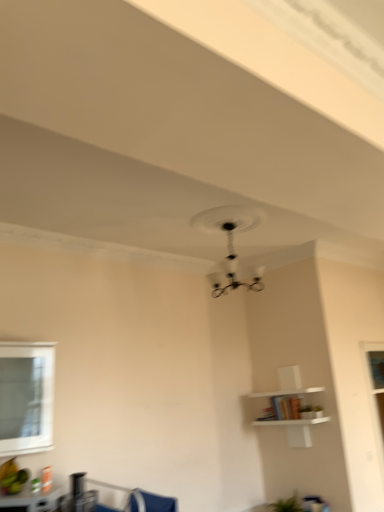
Question: Does matte black table at lower left have a greater width compared to blue fabric swivel chair at lower center?

Choices:
 (A) no
 (B) yes

Answer: (B)

Question: From a real-world perspective, is matte black table at lower left positioned over blue fabric swivel chair at lower center based on gravity?

Choices:
 (A) no
 (B) yes

Answer: (B)

Question: Could you tell me if matte black table at lower left is facing blue fabric swivel chair at lower center?

Choices:
 (A) no
 (B) yes

Answer: (A)

Question: Is matte black table at lower left at the right side of blue fabric swivel chair at lower center?

Choices:
 (A) yes
 (B) no

Answer: (B)

Question: Is matte black table at lower left in front of blue fabric swivel chair at lower center?

Choices:
 (A) no
 (B) yes

Answer: (B)

Question: From the image's perspective, is clear glass window at lower left positioned above or below matte black table at lower left?

Choices:
 (A) above
 (B) below

Answer: (A)

Question: Does point (23, 450) appear closer or farther from the camera than point (28, 502)?

Choices:
 (A) farther
 (B) closer

Answer: (A)

Question: Is clear glass window at lower left situated inside matte black table at lower left or outside?

Choices:
 (A) outside
 (B) inside

Answer: (A)

Question: Is clear glass window at lower left taller or shorter than matte black table at lower left?

Choices:
 (A) tall
 (B) short

Answer: (A)

Question: Visually, is black matte fan at upper center positioned to the left or to the right of blue fabric swivel chair at lower center?

Choices:
 (A) left
 (B) right

Answer: (B)

Question: Is black matte fan at upper center situated inside blue fabric swivel chair at lower center or outside?

Choices:
 (A) inside
 (B) outside

Answer: (B)

Question: From the image's perspective, relative to blue fabric swivel chair at lower center, is black matte fan at upper center above or below?

Choices:
 (A) below
 (B) above

Answer: (B)

Question: Considering the positions of point (258, 281) and point (132, 501), is point (258, 281) closer or farther from the camera than point (132, 501)?

Choices:
 (A) closer
 (B) farther

Answer: (B)

Question: From a real-world perspective, is blue fabric swivel chair at lower center above or below matte black table at lower left?

Choices:
 (A) above
 (B) below

Answer: (B)

Question: Looking at the image, does blue fabric swivel chair at lower center seem bigger or smaller compared to matte black table at lower left?

Choices:
 (A) small
 (B) big

Answer: (A)